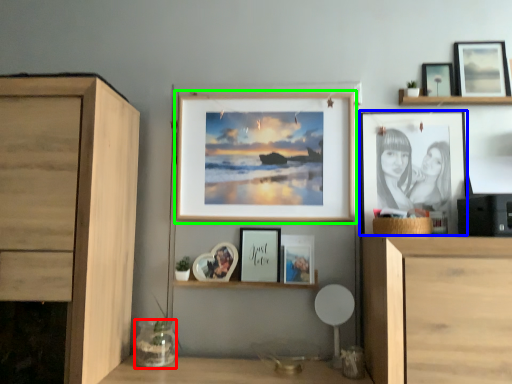
Question: Which is farther away from glass vase (highlighted by a red box)? picture frame (highlighted by a blue box) or picture frame (highlighted by a green box)?

Choices:
 (A) picture frame
 (B) picture frame

Answer: (A)